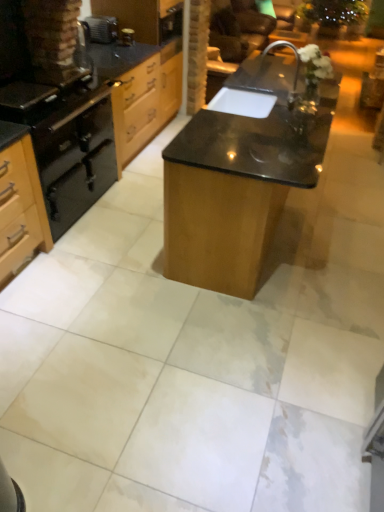
Question: Is brushed metal toaster at upper left, the 2th appliance in the right-to-left sequence, positioned in front of black matte gas stove at left?

Choices:
 (A) no
 (B) yes

Answer: (A)

Question: Can you confirm if brushed metal toaster at upper left, the 2th appliance in the right-to-left sequence, is positioned to the right of black matte gas stove at left?

Choices:
 (A) yes
 (B) no

Answer: (A)

Question: Considering the relative sizes of brushed metal toaster at upper left, the 2th appliance in the right-to-left sequence, and black matte gas stove at left in the image provided, is brushed metal toaster at upper left, the 2th appliance in the right-to-left sequence, taller than black matte gas stove at left?

Choices:
 (A) no
 (B) yes

Answer: (B)

Question: Does brushed metal toaster at upper left, the first appliance from the left, have a lesser width compared to black matte gas stove at left?

Choices:
 (A) no
 (B) yes

Answer: (B)

Question: Can you confirm if brushed metal toaster at upper left, the first appliance from the left, is bigger than black matte gas stove at left?

Choices:
 (A) no
 (B) yes

Answer: (A)

Question: In the image, is black matte gas stove at left positioned in front of or behind wooden drawer at upper left?

Choices:
 (A) front
 (B) behind

Answer: (A)

Question: From the image's perspective, relative to wooden drawer at upper left, is black matte gas stove at left above or below?

Choices:
 (A) above
 (B) below

Answer: (B)

Question: Is black matte gas stove at left wider or thinner than wooden drawer at upper left?

Choices:
 (A) wide
 (B) thin

Answer: (A)

Question: From a real-world perspective, is black matte gas stove at left positioned above or below wooden drawer at upper left?

Choices:
 (A) above
 (B) below

Answer: (A)

Question: Is brown leather armchair at upper center wider or thinner than wooden drawer at upper left?

Choices:
 (A) wide
 (B) thin

Answer: (A)

Question: In the image, is brown leather armchair at upper center positioned in front of or behind wooden drawer at upper left?

Choices:
 (A) front
 (B) behind

Answer: (B)

Question: From their relative heights in the image, would you say brown leather armchair at upper center is taller or shorter than wooden drawer at upper left?

Choices:
 (A) short
 (B) tall

Answer: (A)

Question: From the image's perspective, is brown leather armchair at upper center above or below wooden drawer at upper left?

Choices:
 (A) below
 (B) above

Answer: (B)

Question: From a real-world perspective, relative to matte black oven at left, is wooden drawer at upper left vertically above or below?

Choices:
 (A) above
 (B) below

Answer: (A)

Question: Is wooden drawer at upper left situated inside matte black oven at left or outside?

Choices:
 (A) outside
 (B) inside

Answer: (A)